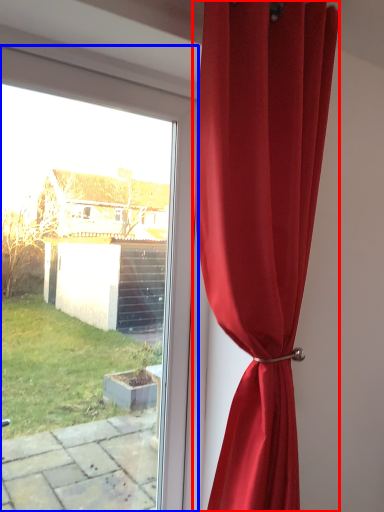
Question: Which of the following is the closest to the observer, curtain (highlighted by a red box) or window (highlighted by a blue box)?

Choices:
 (A) curtain
 (B) window

Answer: (A)